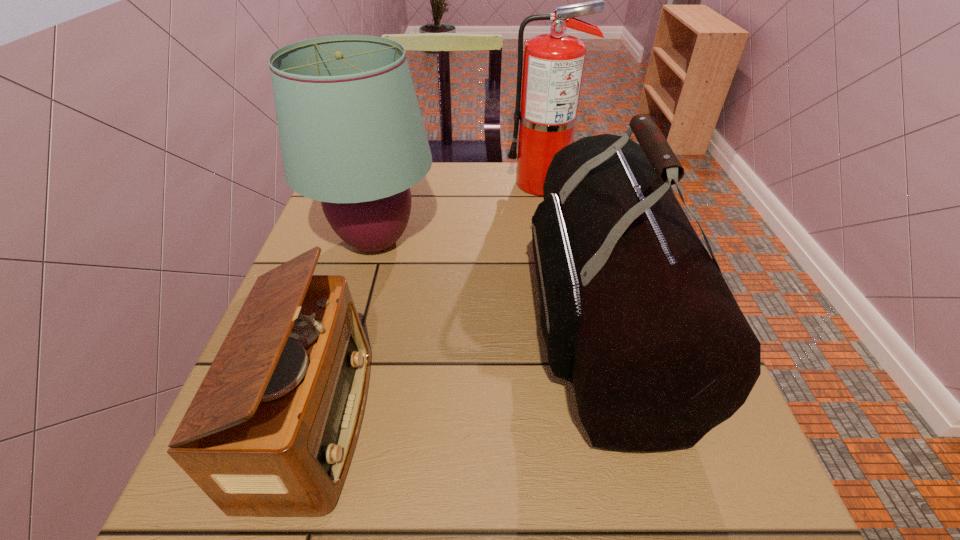
The height and width of the screenshot is (540, 960). Find the location of `object located at the near left corner`. object located at the near left corner is located at coordinates (270, 432).

Identify the location of object located in the far right corner section of the desktop. This screenshot has width=960, height=540. pyautogui.click(x=553, y=64).

What are the coordinates of `free space at the far edge` in the screenshot? It's located at (481, 188).

Identify the location of free space at the near edge of the desktop. The image size is (960, 540). (413, 517).

Locate an element on the screen. This screenshot has width=960, height=540. free space at the left edge is located at coordinates (354, 259).

At what (x,y) coordinates should I click in order to perform the action: click on free spot between the duffel bag and the radio receiver. Please return your answer as a coordinate pair (x, y). This screenshot has height=540, width=960. Looking at the image, I should click on (457, 372).

Identify the location of vacant area between the lampshade and the fire extinguisher. (459, 212).

Locate an element on the screen. The image size is (960, 540). free point between the lampshade and the fire extinguisher is located at coordinates (459, 212).

Locate an element on the screen. vacant space that's between the duffel bag and the radio receiver is located at coordinates (457, 372).

The height and width of the screenshot is (540, 960). I want to click on free point between the lampshade and the duffel bag, so click(487, 282).